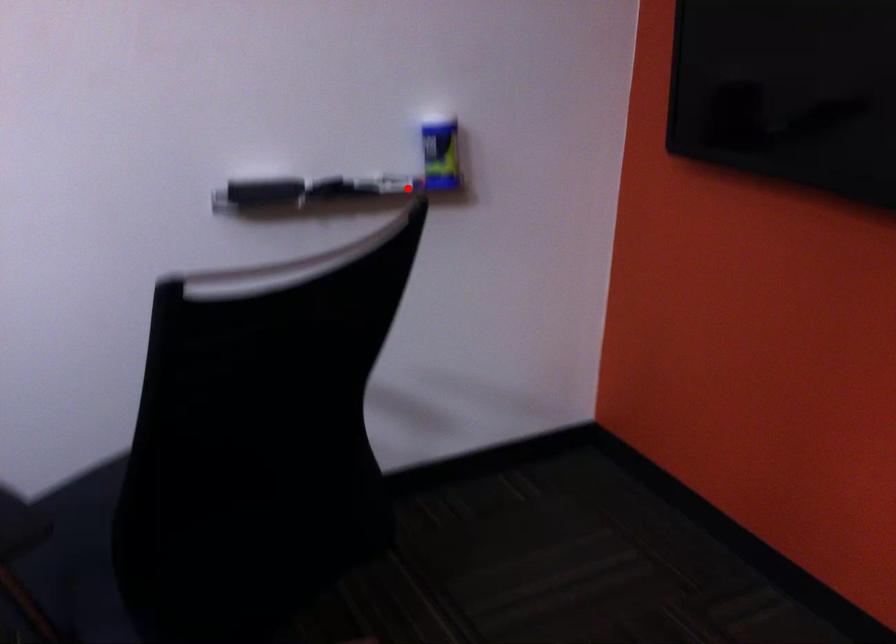
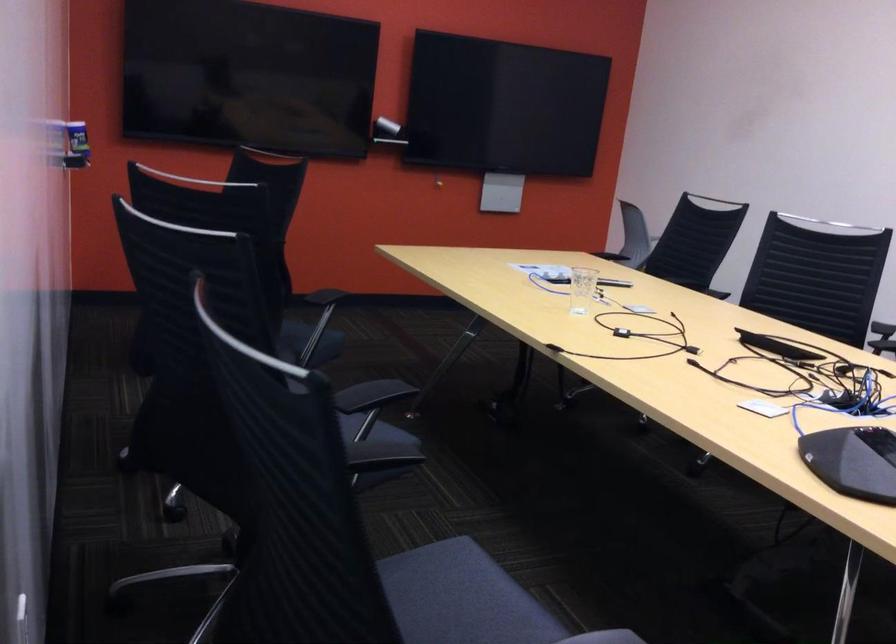
Locate, in the second image, the point that corresponds to the highlighted location in the first image.

(76, 145)